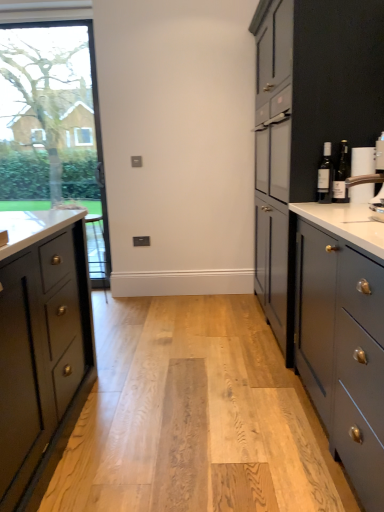
Question: Is matte glass bottle at right, which is counted as the second bottle, starting from the left, to the left of matte glass bottle at right, which is counted as the 2th bottle, starting from the right, from the viewer's perspective?

Choices:
 (A) no
 (B) yes

Answer: (A)

Question: From a real-world perspective, is matte glass bottle at right, which is counted as the second bottle, starting from the left, located higher than matte glass bottle at right, acting as the first bottle starting from the left?

Choices:
 (A) yes
 (B) no

Answer: (B)

Question: Can matte glass bottle at right, acting as the first bottle starting from the left, be found inside matte glass bottle at right, which is counted as the second bottle, starting from the left?

Choices:
 (A) no
 (B) yes

Answer: (A)

Question: Considering the relative positions of matte glass bottle at right, which is counted as the second bottle, starting from the left, and matte glass bottle at right, which is counted as the 2th bottle, starting from the right, in the image provided, is matte glass bottle at right, which is counted as the second bottle, starting from the left, behind matte glass bottle at right, which is counted as the 2th bottle, starting from the right,?

Choices:
 (A) no
 (B) yes

Answer: (A)

Question: Is matte glass bottle at right, which is counted as the second bottle, starting from the left, far away from matte glass bottle at right, which is counted as the 2th bottle, starting from the right?

Choices:
 (A) no
 (B) yes

Answer: (A)

Question: Can you confirm if matte glass bottle at right, the 1th bottle viewed from the right, is shorter than matte glass bottle at right, which is counted as the 2th bottle, starting from the right?

Choices:
 (A) no
 (B) yes

Answer: (A)

Question: Does matte glass bottle at right, which is counted as the second bottle, starting from the left, have a greater width compared to clear glass window at left?

Choices:
 (A) yes
 (B) no

Answer: (B)

Question: Can you confirm if matte glass bottle at right, the 1th bottle viewed from the right, is positioned to the right of clear glass window at left?

Choices:
 (A) yes
 (B) no

Answer: (A)

Question: Is the position of matte glass bottle at right, the 1th bottle viewed from the right, less distant than that of clear glass window at left?

Choices:
 (A) no
 (B) yes

Answer: (B)

Question: Can we say matte glass bottle at right, which is counted as the second bottle, starting from the left, lies outside clear glass window at left?

Choices:
 (A) no
 (B) yes

Answer: (B)

Question: Is matte glass bottle at right, which is counted as the second bottle, starting from the left, facing away from clear glass window at left?

Choices:
 (A) no
 (B) yes

Answer: (A)

Question: Can you confirm if matte glass bottle at right, which is counted as the second bottle, starting from the left, is taller than clear glass window at left?

Choices:
 (A) no
 (B) yes

Answer: (A)

Question: Is matte gray cabinets at right wider than white glossy coffee machine at upper right?

Choices:
 (A) yes
 (B) no

Answer: (A)